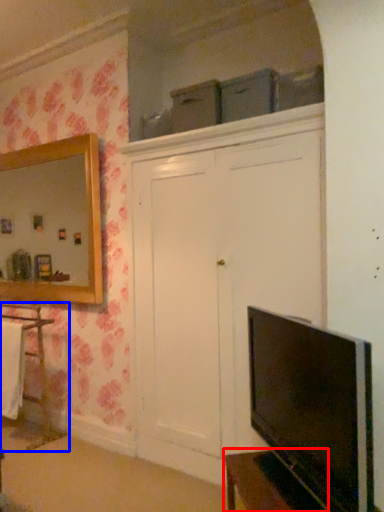
Question: Which object appears farthest to the camera in this image, vanity (highlighted by a red box) or cabinetry (highlighted by a blue box)?

Choices:
 (A) vanity
 (B) cabinetry

Answer: (B)